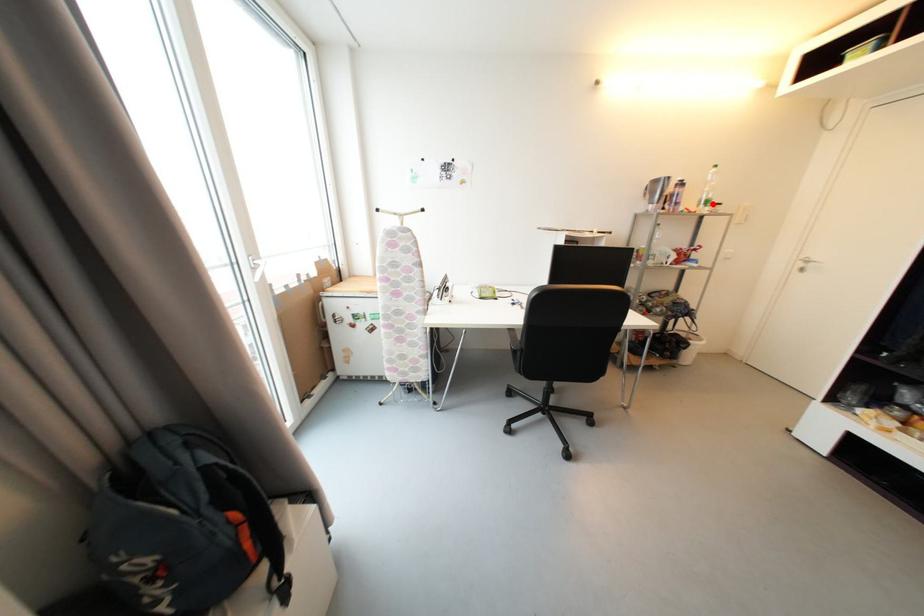
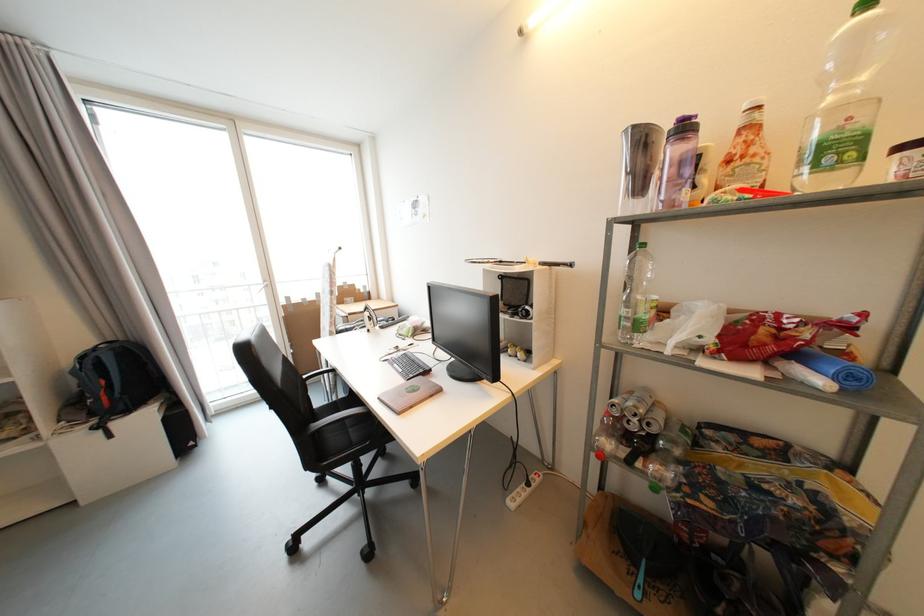
The point at the highlighted location is marked in the first image. Where is the corresponding point in the second image?

(842, 151)